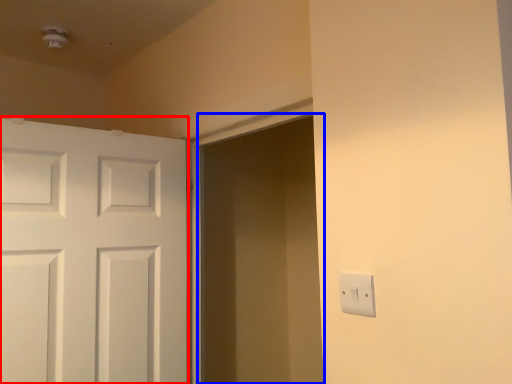
Question: Which object appears closest to the camera in this image, door (highlighted by a red box) or screen door (highlighted by a blue box)?

Choices:
 (A) door
 (B) screen door

Answer: (B)